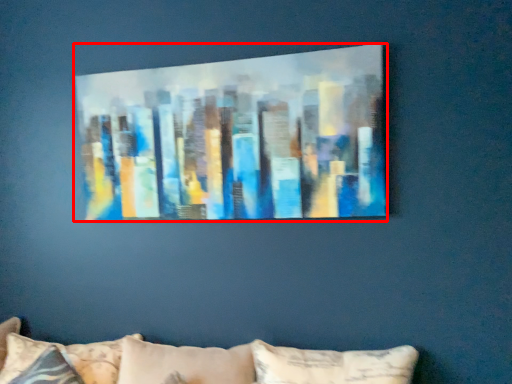
Question: Where is picture frame (annotated by the red box) located in relation to pillow in the image?

Choices:
 (A) left
 (B) right

Answer: (B)